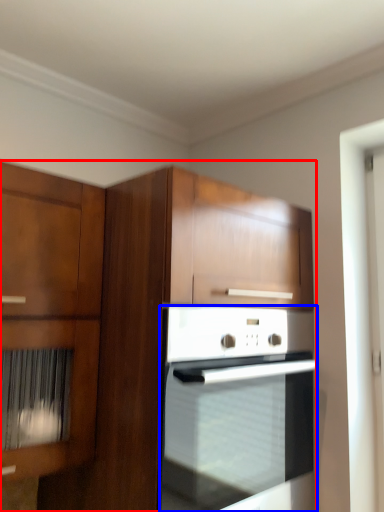
Question: Which object is further to the camera taking this photo, cabinetry (highlighted by a red box) or oven (highlighted by a blue box)?

Choices:
 (A) cabinetry
 (B) oven

Answer: (B)